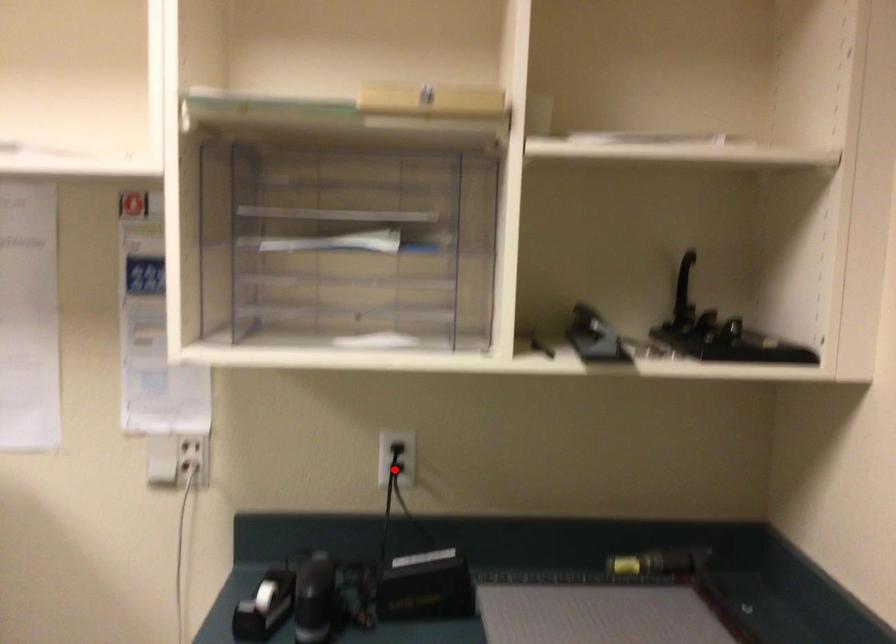
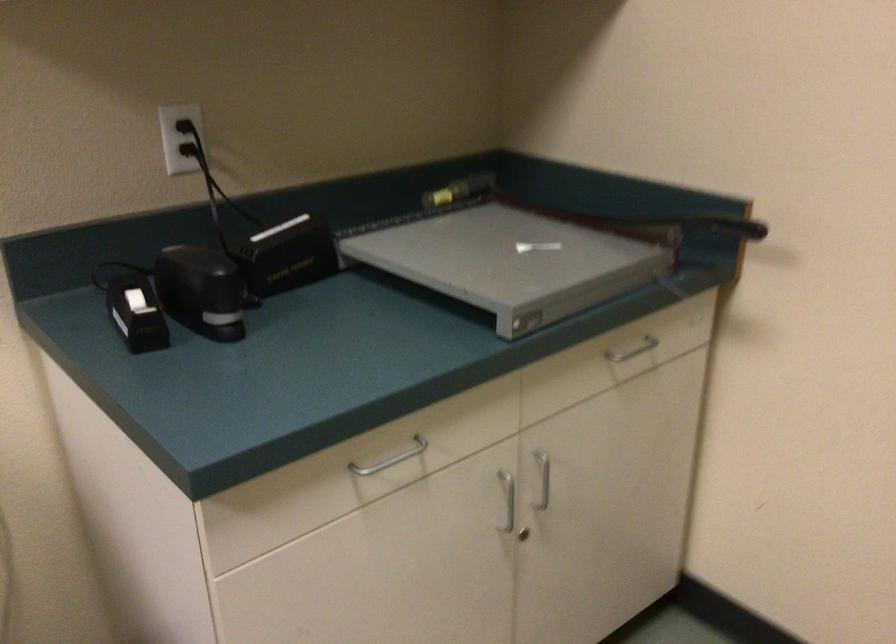
Question: A red point is marked in image1. In image2, is the corresponding 3D point closer to the camera or farther? Reply with the corresponding letter.

Choices:
 (A) The corresponding 3D point is closer.
 (B) The corresponding 3D point is farther.

Answer: (A)